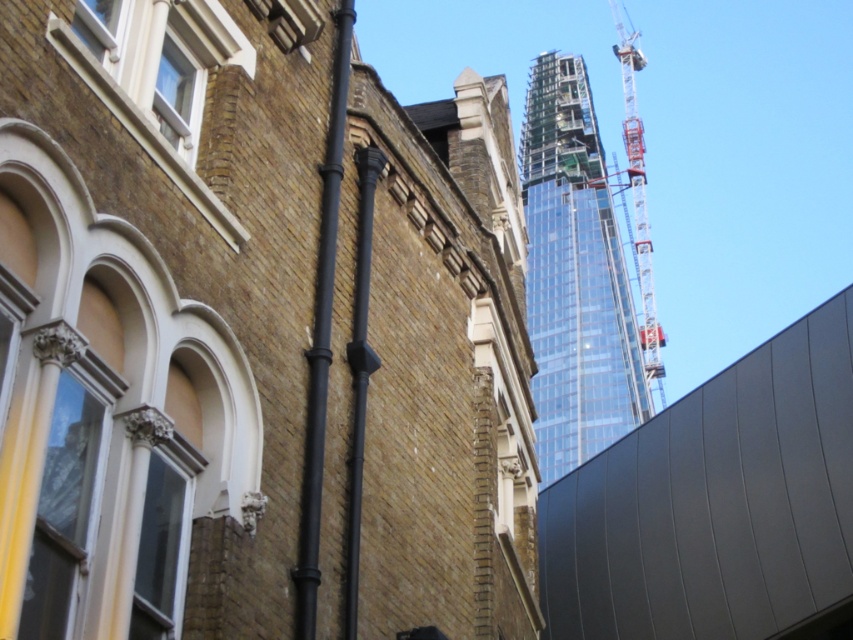
You are an inspector standing at the base of the construction site. You need to check the distance between the black matte pole at center and the metallic gray crane at upper right. Can you reach the crane first before the pole?

The black matte pole at center is closer to the viewer than the metallic gray crane at upper right, so you will reach the pole before the crane.